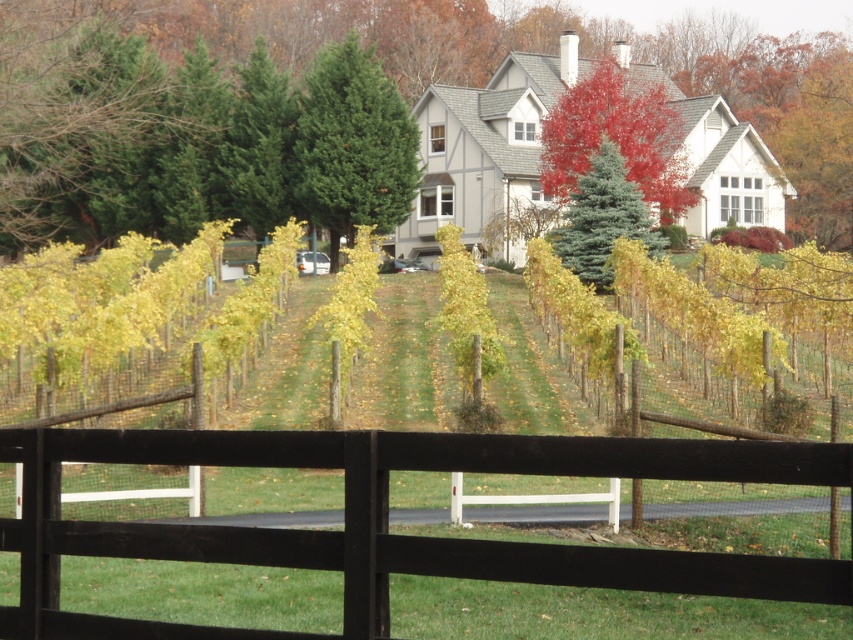
Who is positioned more to the left, green leafy tree at upper center or red glossy tree at upper center?

Positioned to the left is green leafy tree at upper center.

Can you confirm if green leafy tree at upper center is smaller than red glossy tree at upper center?

No, green leafy tree at upper center is not smaller than red glossy tree at upper center.

Does point (22, 22) lie in front of point (660, 220)?

Yes, it is in front of point (660, 220).

The height and width of the screenshot is (640, 853). Find the location of `green leafy tree at upper center`. green leafy tree at upper center is located at coordinates (386, 72).

Does red glossy tree at upper center lie in front of blue-green fir tree at center-right?

No, red glossy tree at upper center is behind blue-green fir tree at center-right.

Who is higher up, red glossy tree at upper center or blue-green fir tree at center-right?

red glossy tree at upper center

Is point (544, 141) behind point (633, 209)?

That is True.

Locate an element on the screen. The height and width of the screenshot is (640, 853). red glossy tree at upper center is located at coordinates (618, 136).

The width and height of the screenshot is (853, 640). What do you see at coordinates (387, 520) in the screenshot?
I see `black wood fence at center` at bounding box center [387, 520].

Does black wood fence at center appear under red glossy tree at upper center?

Indeed, black wood fence at center is positioned under red glossy tree at upper center.

Is point (134, 545) more distant than point (581, 90)?

That is False.

Where is `black wood fence at center`? black wood fence at center is located at coordinates (387, 520).